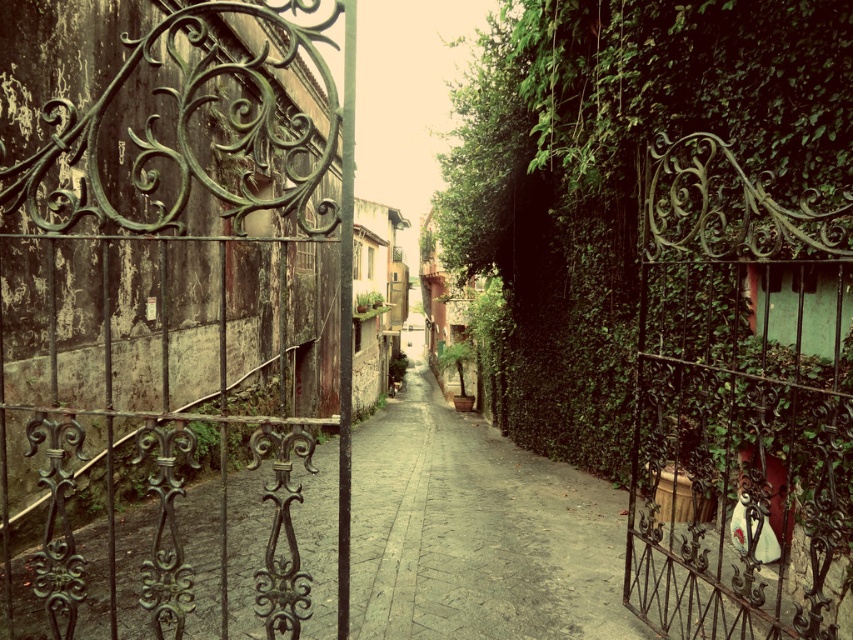
Question: From the image, what is the correct spatial relationship of green wrought iron gate at left in relation to rusty wrought iron gate at center?

Choices:
 (A) below
 (B) above

Answer: (B)

Question: Which object is closer to the camera taking this photo?

Choices:
 (A) green wrought iron gate at left
 (B) rusty wrought iron gate at center

Answer: (A)

Question: Does green wrought iron gate at left appear over rusty wrought iron gate at center?

Choices:
 (A) yes
 (B) no

Answer: (A)

Question: Is green wrought iron gate at left closer to camera compared to rusty wrought iron gate at center?

Choices:
 (A) yes
 (B) no

Answer: (A)

Question: Among these points, which one is farthest from the camera?

Choices:
 (A) (653, 323)
 (B) (181, 61)

Answer: (A)